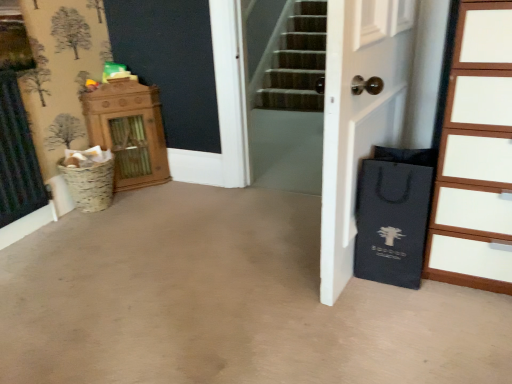
Question: Is wooden chest of drawers at right touching black paper bag at right?

Choices:
 (A) yes
 (B) no

Answer: (B)

Question: From a real-world perspective, is wooden chest of drawers at right positioned under black paper bag at right based on gravity?

Choices:
 (A) yes
 (B) no

Answer: (B)

Question: Does wooden chest of drawers at right have a lesser width compared to black paper bag at right?

Choices:
 (A) no
 (B) yes

Answer: (A)

Question: Can you confirm if wooden chest of drawers at right is smaller than black paper bag at right?

Choices:
 (A) yes
 (B) no

Answer: (B)

Question: Considering the relative positions of wooden chest of drawers at right and black paper bag at right in the image provided, is wooden chest of drawers at right behind black paper bag at right?

Choices:
 (A) yes
 (B) no

Answer: (B)

Question: Considering their positions, is wooden cabinet at left located in front of or behind wooden chest of drawers at right?

Choices:
 (A) front
 (B) behind

Answer: (B)

Question: Is wooden cabinet at left to the left or to the right of wooden chest of drawers at right in the image?

Choices:
 (A) left
 (B) right

Answer: (A)

Question: From the image's perspective, relative to wooden chest of drawers at right, is wooden cabinet at left above or below?

Choices:
 (A) above
 (B) below

Answer: (A)

Question: Considering the positions of wooden cabinet at left and wooden chest of drawers at right in the image, is wooden cabinet at left taller or shorter than wooden chest of drawers at right?

Choices:
 (A) short
 (B) tall

Answer: (A)

Question: Considering the positions of wooden cabinet at left and black paper bag at right in the image, is wooden cabinet at left bigger or smaller than black paper bag at right?

Choices:
 (A) small
 (B) big

Answer: (B)

Question: From the image's perspective, is wooden cabinet at left located above or below black paper bag at right?

Choices:
 (A) below
 (B) above

Answer: (B)

Question: Considering the positions of wooden cabinet at left and black paper bag at right in the image, is wooden cabinet at left taller or shorter than black paper bag at right?

Choices:
 (A) tall
 (B) short

Answer: (A)

Question: Is wooden cabinet at left situated inside black paper bag at right or outside?

Choices:
 (A) inside
 (B) outside

Answer: (B)

Question: Is wooden cabinet at left to the left or to the right of white matte door at center in the image?

Choices:
 (A) left
 (B) right

Answer: (A)

Question: In terms of width, does wooden cabinet at left look wider or thinner when compared to white matte door at center?

Choices:
 (A) thin
 (B) wide

Answer: (B)